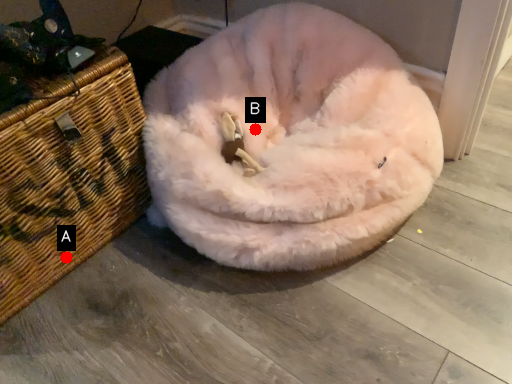
Question: Two points are circled on the image, labeled by A and B beside each circle. Among these points, which one is farthest from the camera?

Choices:
 (A) A is further
 (B) B is further

Answer: (B)